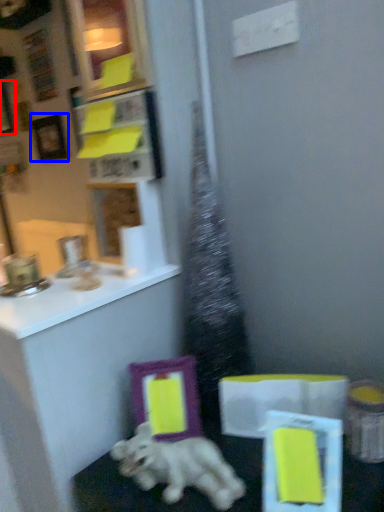
Question: Which object is further to the camera taking this photo, picture frame (highlighted by a red box) or picture frame (highlighted by a blue box)?

Choices:
 (A) picture frame
 (B) picture frame

Answer: (A)